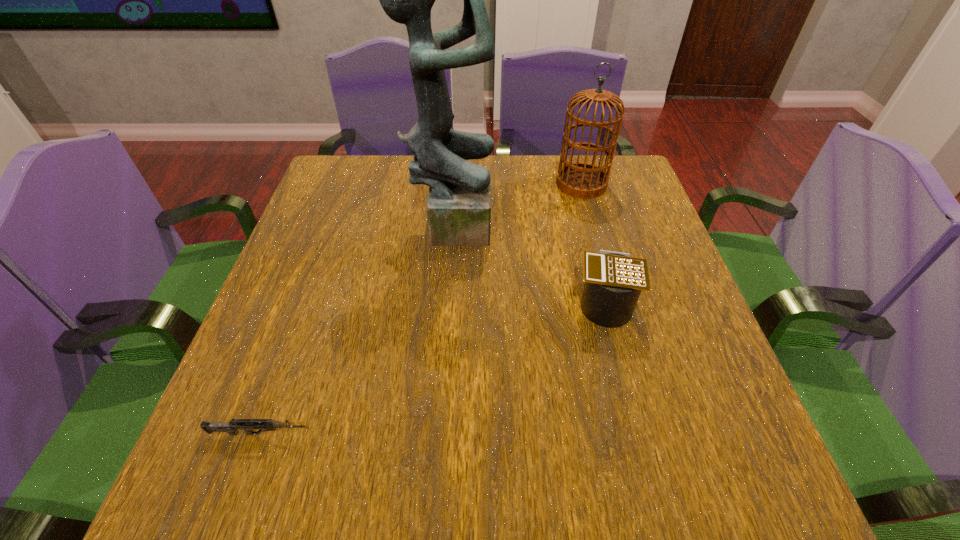
The width and height of the screenshot is (960, 540). Identify the location of blank area located 0.140m aimed along the barrel of the nearest object. (395, 434).

You are a GUI agent. You are given a task and a screenshot of the screen. Output one action in this format:
    pyautogui.click(x=<x>, y=<y>)
    Task: Click on the sculpture positioned at the far edge
    The width and height of the screenshot is (960, 540).
    Given the screenshot: What is the action you would take?
    pyautogui.click(x=459, y=202)

The image size is (960, 540). What are the coordinates of `birdcage situated at the far edge` in the screenshot? It's located at (582, 180).

You are a GUI agent. You are given a task and a screenshot of the screen. Output one action in this format:
    pyautogui.click(x=<x>, y=<y>)
    Task: Click on the object located in the left edge section of the desktop
    
    Given the screenshot: What is the action you would take?
    pyautogui.click(x=231, y=427)

Where is `birdcage that is positioned at the right edge`? This screenshot has height=540, width=960. birdcage that is positioned at the right edge is located at coordinates (582, 180).

Identify the location of calculator that is at the right edge. (613, 281).

I want to click on object that is at the far right corner, so click(x=582, y=180).

Identify the location of vacant space at the far edge. Image resolution: width=960 pixels, height=540 pixels. (526, 200).

The height and width of the screenshot is (540, 960). I want to click on vacant space at the left edge of the desktop, so click(x=283, y=351).

Where is `vacant region at the right edge of the desktop`? The width and height of the screenshot is (960, 540). vacant region at the right edge of the desktop is located at coordinates [x=650, y=345].